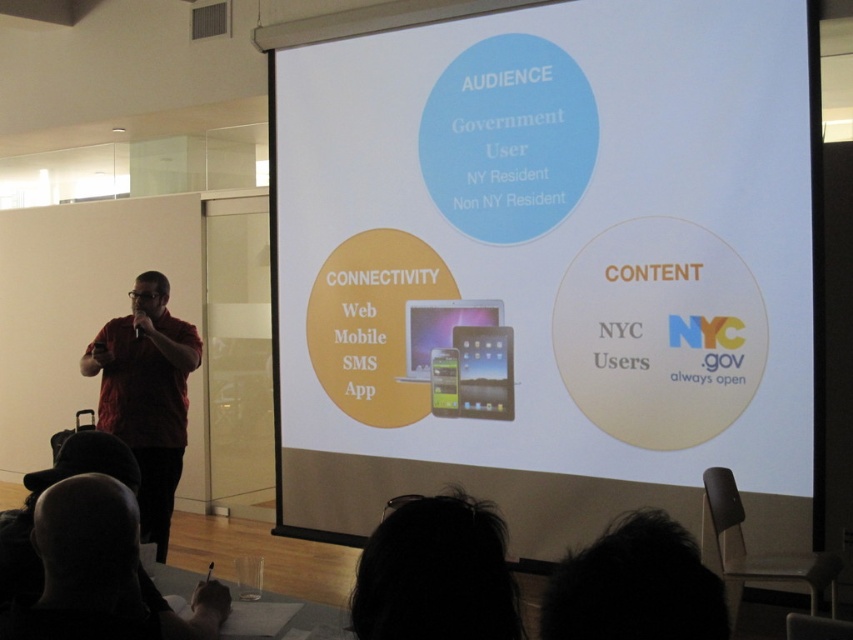
You are an event planner who needs to ensure the white matte projection screen at center is visible to everyone in the audience. Considering the black hair at lower left is blocking part of the screen, can you confirm if the screen is still large enough to be seen clearly?

The white matte projection screen at center is larger in size than the black hair at lower left, so it should still be visible to the audience despite the partial obstruction.

In the presentation scene, there is a speaker on the left and an audience at the bottom. A point at coordinates (x=436, y=573) marks a feature in the image. What is the feature located at this point?

The point at (x=436, y=573) indicates dark hair at lower center.